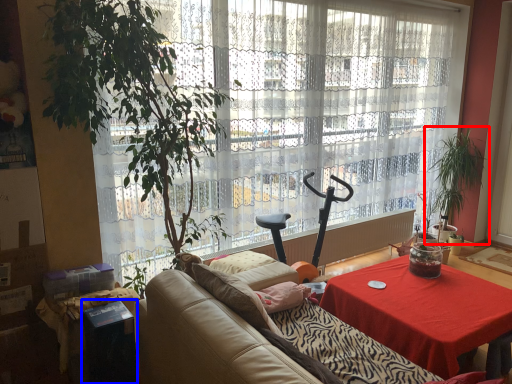
Question: Among these objects, which one is nearest to the camera, houseplant (highlighted by a red box) or cocktail table (highlighted by a blue box)?

Choices:
 (A) houseplant
 (B) cocktail table

Answer: (B)